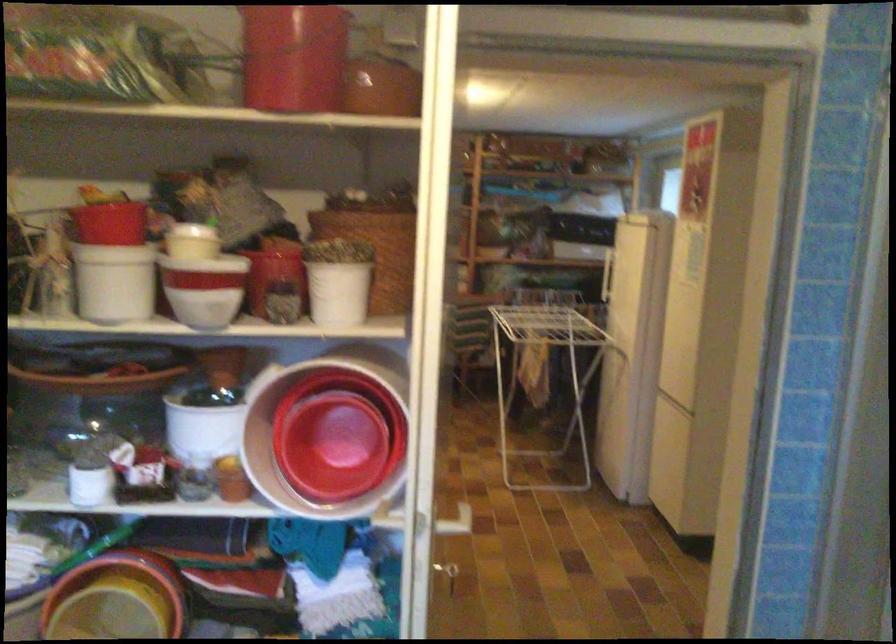
This screenshot has width=896, height=644. Describe the element at coordinates (202, 281) in the screenshot. I see `a white and red bowl` at that location.